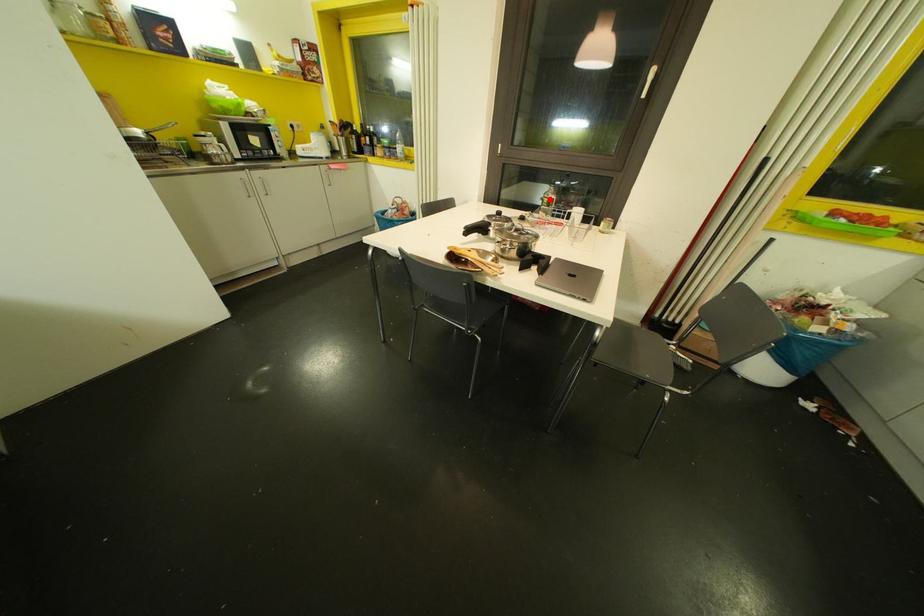
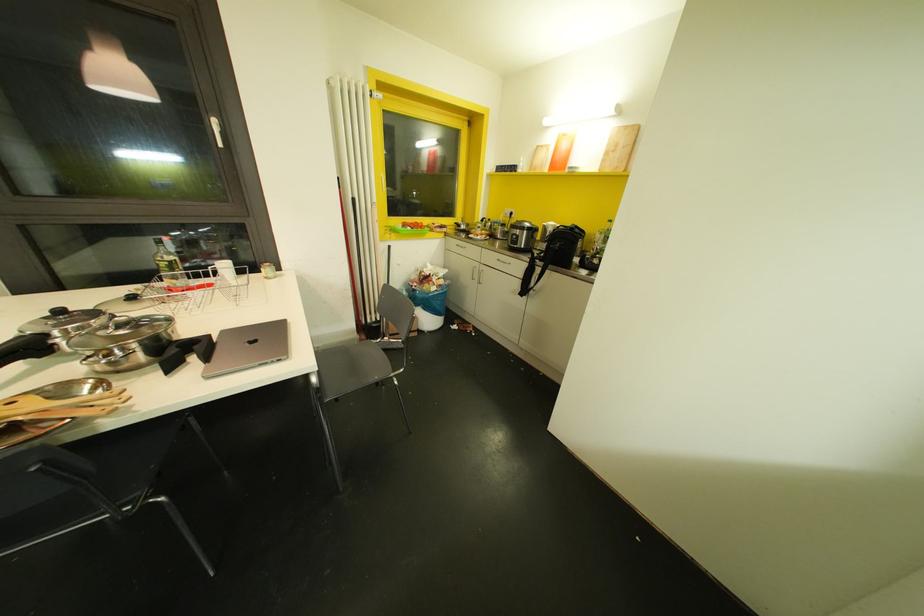
Where in the second image is the point corresponding to the highlighted location from the first image?

(169, 262)